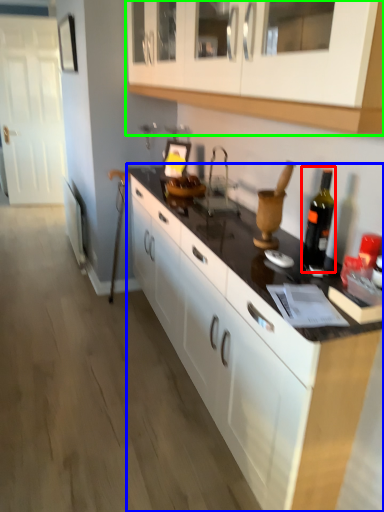
Question: Based on their relative distances, which object is nearer to bottle (highlighted by a red box)? Choose from countertop (highlighted by a blue box) and cabinetry (highlighted by a green box).

Choices:
 (A) countertop
 (B) cabinetry

Answer: (A)